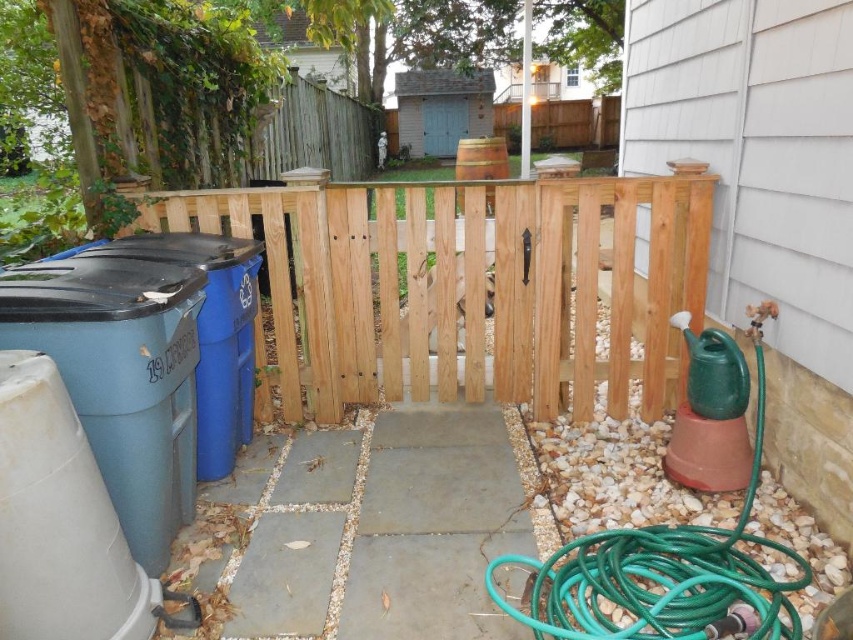
Question: Can you confirm if natural wood gate at center is bigger than green rubber garden hose at right?

Choices:
 (A) yes
 (B) no

Answer: (A)

Question: Which point is farther to the camera?

Choices:
 (A) wooden barrel at center
 (B) natural wood gate at center

Answer: (A)

Question: Does green rubber garden hose at right have a larger size compared to wooden barrel at center?

Choices:
 (A) yes
 (B) no

Answer: (B)

Question: Which point appears closest to the camera in this image?

Choices:
 (A) (791, 550)
 (B) (531, 289)

Answer: (A)

Question: Considering the relative positions of green rubber garden hose at right and wooden barrel at center in the image provided, where is green rubber garden hose at right located with respect to wooden barrel at center?

Choices:
 (A) below
 (B) above

Answer: (A)

Question: Which point is closer to the camera?

Choices:
 (A) (666, 385)
 (B) (570, 630)

Answer: (B)